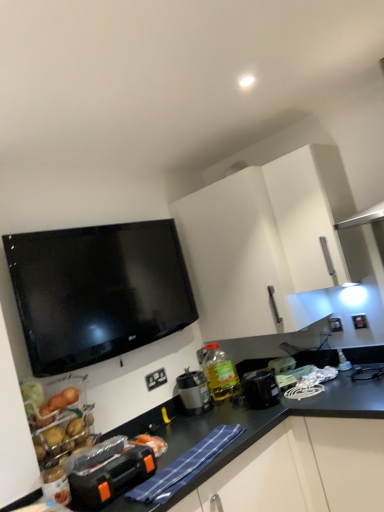
This screenshot has height=512, width=384. What do you see at coordinates (261, 389) in the screenshot? I see `black plastic container at lower right, which is the 2th appliance in front-to-back order` at bounding box center [261, 389].

The height and width of the screenshot is (512, 384). What do you see at coordinates (274, 246) in the screenshot?
I see `white matte cabinet at upper center` at bounding box center [274, 246].

Identify the location of white plastic electric outlet at upper right, the first electric outlet viewed from the back. The image size is (384, 512). (335, 324).

Locate an element on the screen. translucent yellow bottle at center is located at coordinates (220, 373).

In order to click on white plastic toaster at right, the 1th appliance from the back in this screenshot , I will do `click(282, 364)`.

Is white plastic toaster at right, the 1th appliance from the back, in contact with white plastic electrical outlet at lower center, which is counted as the 1th electric outlet, starting from the front?

No, white plastic toaster at right, the 1th appliance from the back, is not touching white plastic electrical outlet at lower center, which is counted as the 1th electric outlet, starting from the front.

From the image's perspective, starting from the white plastic electrical outlet at lower center, which is counted as the second electric outlet, starting from the back, which appliance is the 2nd one above? Please provide its 2D coordinates.

[(282, 364)]

How many degrees apart are the facing directions of white plastic toaster at right, which is the 1th appliance from right to left, and white plastic electrical outlet at lower center, which is counted as the second electric outlet, starting from the back?

The facing directions of white plastic toaster at right, which is the 1th appliance from right to left, and white plastic electrical outlet at lower center, which is counted as the second electric outlet, starting from the back, are 45.3 degrees apart.

Which object is positioned more to the right, white plastic toaster at right, the 4th appliance positioned from the left, or white plastic electrical outlet at lower center, which is the second electric outlet in top-to-bottom order?

Positioned to the right is white plastic toaster at right, the 4th appliance positioned from the left.

This screenshot has width=384, height=512. Find the location of `the 1st appliance behind the white matte cabinet at upper center, starting your count from the anchor`. the 1st appliance behind the white matte cabinet at upper center, starting your count from the anchor is located at coordinates (261, 389).

Which is more to the left, white matte cabinet at upper center or black plastic container at lower right, arranged as the 3th appliance when viewed from the back?

black plastic container at lower right, arranged as the 3th appliance when viewed from the back, is more to the left.

Consider the image. Considering their positions, is white matte cabinet at upper center located in front of or behind black plastic container at lower right, arranged as the 3th appliance when viewed from the back?

white matte cabinet at upper center is in front of black plastic container at lower right, arranged as the 3th appliance when viewed from the back.

Is white matte cabinet at upper center not inside black plastic container at lower right, which is counted as the third appliance, starting from the left?

white matte cabinet at upper center lies outside black plastic container at lower right, which is counted as the third appliance, starting from the left,'s area.

From the image's perspective, between white plastic electric outlet at upper right, marked as the 2th electric outlet in a left-to-right arrangement, and translucent yellow bottle at center, who is located below?

translucent yellow bottle at center is shown below in the image.

Between white plastic electric outlet at upper right, the 1th electric outlet when ordered from right to left, and translucent yellow bottle at center, which one has larger width?

translucent yellow bottle at center.

From a real-world perspective, is white plastic electric outlet at upper right, the first electric outlet viewed from the back, located beneath translucent yellow bottle at center?

No, from a real-world perspective, white plastic electric outlet at upper right, the first electric outlet viewed from the back, is not beneath translucent yellow bottle at center.

From the image's perspective, is white plastic electric outlet at upper right, marked as the 2th electric outlet in a left-to-right arrangement, above or below black plastic container at lower right, arranged as the 3th appliance when viewed from the back?

Clearly, from the image's perspective, white plastic electric outlet at upper right, marked as the 2th electric outlet in a left-to-right arrangement, is above black plastic container at lower right, arranged as the 3th appliance when viewed from the back.

Would you say black plastic container at lower right, which is counted as the third appliance, starting from the left, is part of white plastic electric outlet at upper right, marked as the 2th electric outlet in a left-to-right arrangement,'s contents?

That's incorrect, black plastic container at lower right, which is counted as the third appliance, starting from the left, is not inside white plastic electric outlet at upper right, marked as the 2th electric outlet in a left-to-right arrangement.

Is white plastic electric outlet at upper right, the first electric outlet positioned from the top, far away from black plastic container at lower right, which is the 2th appliance in front-to-back order?

No, white plastic electric outlet at upper right, the first electric outlet positioned from the top, is not far away from black plastic container at lower right, which is the 2th appliance in front-to-back order.

Considering the sizes of objects white plastic electrical outlet at lower center, which is counted as the second electric outlet, starting from the back, and translucent yellow bottle at center in the image provided, who is wider, white plastic electrical outlet at lower center, which is counted as the second electric outlet, starting from the back, or translucent yellow bottle at center?

translucent yellow bottle at center.

Is point (155, 382) more distant than point (216, 364)?

That is False.

From a real-world perspective, which is physically above, white plastic electrical outlet at lower center, which is counted as the 1th electric outlet, starting from the front, or translucent yellow bottle at center?

white plastic electrical outlet at lower center, which is counted as the 1th electric outlet, starting from the front.

Are white plastic electrical outlet at lower center, which is counted as the second electric outlet, starting from the back, and translucent yellow bottle at center located far from each other?

No.

Is point (190, 391) closer to camera compared to point (149, 384)?

No, it is not.

Is white plastic electrical outlet at lower center, which is the first electric outlet from bottom to top, a part of matte black coffee maker at center, which ranks as the third appliance in front-to-back order?

No, white plastic electrical outlet at lower center, which is the first electric outlet from bottom to top, is located outside of matte black coffee maker at center, which ranks as the third appliance in front-to-back order.

Are matte black coffee maker at center, which ranks as the third appliance in front-to-back order, and white plastic electrical outlet at lower center, which is counted as the 1th electric outlet, starting from the front, located far from each other?

No, matte black coffee maker at center, which ranks as the third appliance in front-to-back order, is not far away from white plastic electrical outlet at lower center, which is counted as the 1th electric outlet, starting from the front.

From a real-world perspective, does matte black coffee maker at center, which ranks as the third appliance in front-to-back order, stand above white plastic electrical outlet at lower center, which is the first electric outlet from bottom to top?

No, from a real-world perspective, matte black coffee maker at center, which ranks as the third appliance in front-to-back order, is not on top of white plastic electrical outlet at lower center, which is the first electric outlet from bottom to top.

Is white matte cabinet at upper center smaller than white plastic electrical outlet at lower center, which is the second electric outlet in top-to-bottom order?

No, white matte cabinet at upper center is not smaller than white plastic electrical outlet at lower center, which is the second electric outlet in top-to-bottom order.

Considering the positions of point (204, 336) and point (152, 389), is point (204, 336) closer or farther from the camera than point (152, 389)?

Clearly, point (204, 336) is more distant from the camera than point (152, 389).

From the image's perspective, which is above, white matte cabinet at upper center or white plastic electrical outlet at lower center, the 2th electric outlet viewed from the right?

white matte cabinet at upper center appears higher in the image.

How different are the orientations of white matte cabinet at upper center and white plastic electrical outlet at lower center, the first electric outlet in the left-to-right sequence, in degrees?

89.7 degrees separate the facing orientations of white matte cabinet at upper center and white plastic electrical outlet at lower center, the first electric outlet in the left-to-right sequence.

Where is `the 2nd appliance positioned above the white plastic electrical outlet at lower center, the first electric outlet in the left-to-right sequence (from the image's perspective)`? This screenshot has height=512, width=384. the 2nd appliance positioned above the white plastic electrical outlet at lower center, the first electric outlet in the left-to-right sequence (from the image's perspective) is located at coordinates (282, 364).

At what (x,y) coordinates should I click in order to perform the action: click on appliance that is the 2nd object located below the white matte cabinet at upper center (from the image's perspective). Please return your answer as a coordinate pair (x, y). This screenshot has height=512, width=384. Looking at the image, I should click on (261, 389).

From the image, which object appears to be nearer to matte black coffee maker at center, acting as the 3th appliance starting from the right, white plastic electrical outlet at lower center, which is the second electric outlet in top-to-bottom order, or white plastic toaster at right, the 4th appliance positioned from the left?

white plastic electrical outlet at lower center, which is the second electric outlet in top-to-bottom order, is positioned closer to the anchor matte black coffee maker at center, acting as the 3th appliance starting from the right.

When comparing their distances from white plastic electric outlet at upper right, the first electric outlet viewed from the back, does black plastic toolbox at lower left, placed as the 1th appliance when sorted from front to back, or white plastic electrical outlet at lower center, which is counted as the second electric outlet, starting from the back, seem further?

black plastic toolbox at lower left, placed as the 1th appliance when sorted from front to back, is positioned further to the anchor white plastic electric outlet at upper right, the first electric outlet viewed from the back.

Considering their positions, is black plastic toolbox at lower left, the 1th appliance from the left, positioned closer to black plastic container at lower right, the second appliance viewed from the right, than matte black coffee maker at center, the 2th appliance positioned from the left?

Among the two, matte black coffee maker at center, the 2th appliance positioned from the left, is located nearer to black plastic container at lower right, the second appliance viewed from the right.

Which object lies further to the anchor point white matte cabinet at upper center, white plastic electrical outlet at lower center, which is the second electric outlet in top-to-bottom order, or matte black coffee maker at center, the 2th appliance positioned from the left?

The object further to white matte cabinet at upper center is white plastic electrical outlet at lower center, which is the second electric outlet in top-to-bottom order.

From the image, which object appears to be farther from black plastic toolbox at lower left, placed as the 1th appliance when sorted from front to back, translucent yellow bottle at center or black plastic container at lower right, the second appliance viewed from the right?

translucent yellow bottle at center.

Looking at the image, which one is located further to white plastic electrical outlet at lower center, which is counted as the second electric outlet, starting from the back, black plastic toolbox at lower left, the 1th appliance from the left, or black plastic container at lower right, which is the 2th appliance in front-to-back order?

black plastic toolbox at lower left, the 1th appliance from the left, lies further to white plastic electrical outlet at lower center, which is counted as the second electric outlet, starting from the back, than the other object.

Which object lies further to the anchor point white plastic electrical outlet at lower center, which is the first electric outlet from bottom to top, white matte cabinet at upper center or translucent yellow bottle at center?

Based on the image, white matte cabinet at upper center appears to be further to white plastic electrical outlet at lower center, which is the first electric outlet from bottom to top.

Which object lies nearer to the anchor point black plastic container at lower right, arranged as the 3th appliance when viewed from the back, white plastic toaster at right, which is the 1th appliance from right to left, or white matte cabinet at upper center?

Based on the image, white plastic toaster at right, which is the 1th appliance from right to left, appears to be nearer to black plastic container at lower right, arranged as the 3th appliance when viewed from the back.

Image resolution: width=384 pixels, height=512 pixels. Identify the location of appliance between white matte cabinet at upper center and black plastic container at lower right, which is counted as the third appliance, starting from the left, vertically. (282, 364).

You are a GUI agent. You are given a task and a screenshot of the screen. Output one action in this format:
    pyautogui.click(x=<x>, y=<y>)
    Task: Click on the appliance between black plastic container at lower right, arranged as the 3th appliance when viewed from the back, and white plastic electric outlet at upper right, which appears as the 2th electric outlet when viewed from the front
    Image resolution: width=384 pixels, height=512 pixels.
    Given the screenshot: What is the action you would take?
    pyautogui.click(x=282, y=364)

You are a GUI agent. You are given a task and a screenshot of the screen. Output one action in this format:
    pyautogui.click(x=<x>, y=<y>)
    Task: Click on the electric outlet located between black plastic toolbox at lower left, the fourth appliance positioned from the back, and translucent yellow bottle at center in the depth direction
    This screenshot has width=384, height=512.
    Given the screenshot: What is the action you would take?
    pyautogui.click(x=156, y=379)

I want to click on bottle that lies between white matte cabinet at upper center and black plastic container at lower right, arranged as the 3th appliance when viewed from the back, from top to bottom, so click(220, 373).